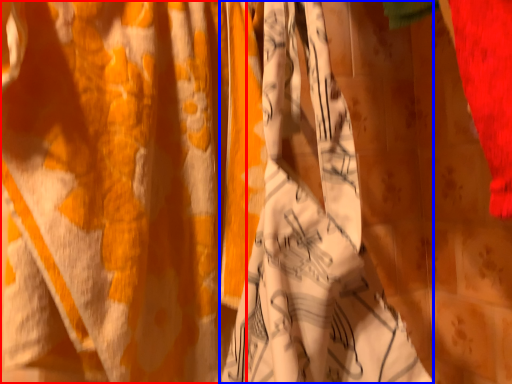
Question: Which of the following is the farthest to the observer, curtain (highlighted by a red box) or clothing (highlighted by a blue box)?

Choices:
 (A) curtain
 (B) clothing

Answer: (A)